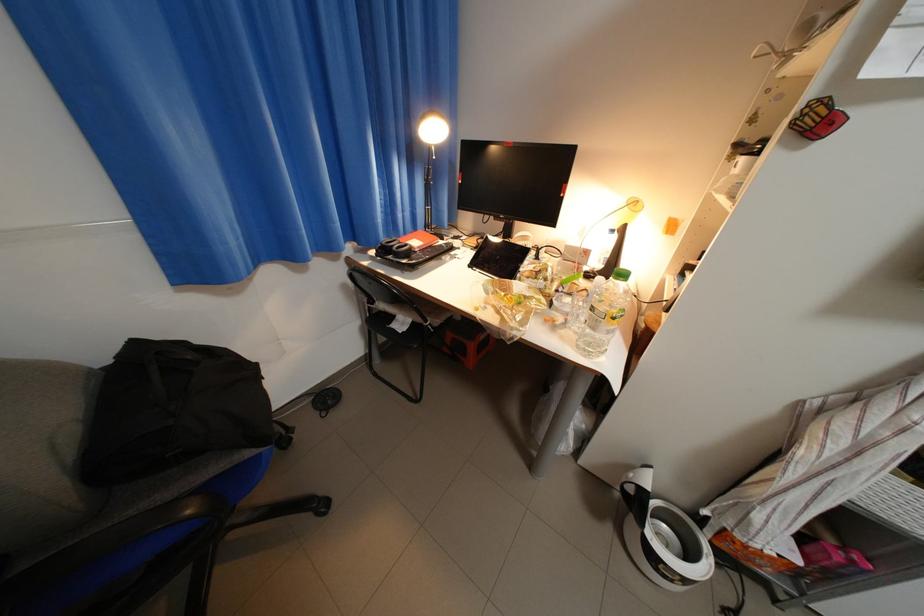
The location [603,315] corresponds to which object?

It refers to a large water bottle.